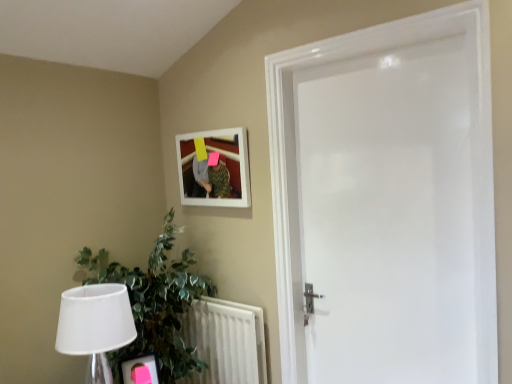
Question: From the image's perspective, is white fabric lampshade at lower left over white glossy door at center?

Choices:
 (A) yes
 (B) no

Answer: (B)

Question: Can we say white fabric lampshade at lower left lies outside white glossy door at center?

Choices:
 (A) yes
 (B) no

Answer: (A)

Question: Is white fabric lampshade at lower left wider than white glossy door at center?

Choices:
 (A) yes
 (B) no

Answer: (A)

Question: From a real-world perspective, is white fabric lampshade at lower left physically above white glossy door at center?

Choices:
 (A) yes
 (B) no

Answer: (B)

Question: Could you tell me if white fabric lampshade at lower left is turned towards white glossy door at center?

Choices:
 (A) no
 (B) yes

Answer: (A)

Question: From a real-world perspective, is green leafy plant at lower left positioned above or below white textured radiator at lower left?

Choices:
 (A) below
 (B) above

Answer: (B)

Question: Based on their sizes in the image, would you say green leafy plant at lower left is bigger or smaller than white textured radiator at lower left?

Choices:
 (A) big
 (B) small

Answer: (A)

Question: Looking at their shapes, would you say green leafy plant at lower left is wider or thinner than white textured radiator at lower left?

Choices:
 (A) wide
 (B) thin

Answer: (A)

Question: In the image, is green leafy plant at lower left on the left side or the right side of white textured radiator at lower left?

Choices:
 (A) left
 (B) right

Answer: (A)

Question: Considering the relative positions of white textured radiator at lower left and white matte picture frame at upper center in the image provided, is white textured radiator at lower left to the left or to the right of white matte picture frame at upper center?

Choices:
 (A) left
 (B) right

Answer: (B)

Question: Considering the positions of white textured radiator at lower left and white matte picture frame at upper center in the image, is white textured radiator at lower left wider or thinner than white matte picture frame at upper center?

Choices:
 (A) thin
 (B) wide

Answer: (B)

Question: Is point (210, 372) positioned closer to the camera than point (247, 187)?

Choices:
 (A) closer
 (B) farther

Answer: (B)

Question: Considering the positions of white textured radiator at lower left and white matte picture frame at upper center in the image, is white textured radiator at lower left taller or shorter than white matte picture frame at upper center?

Choices:
 (A) tall
 (B) short

Answer: (A)

Question: Considering the positions of white matte picture frame at upper center and white fabric lampshade at lower left in the image, is white matte picture frame at upper center taller or shorter than white fabric lampshade at lower left?

Choices:
 (A) short
 (B) tall

Answer: (A)

Question: Considering the relative positions of white matte picture frame at upper center and white fabric lampshade at lower left in the image provided, is white matte picture frame at upper center to the left or to the right of white fabric lampshade at lower left?

Choices:
 (A) right
 (B) left

Answer: (A)